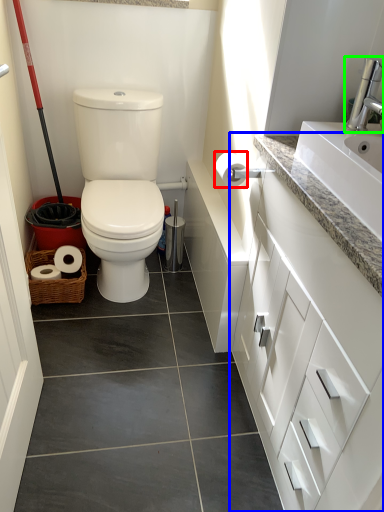
Question: Considering the real-world distances, which object is closest to toilet paper (highlighted by a red box)? bathroom cabinet (highlighted by a blue box) or faucet (highlighted by a green box).

Choices:
 (A) bathroom cabinet
 (B) faucet

Answer: (B)